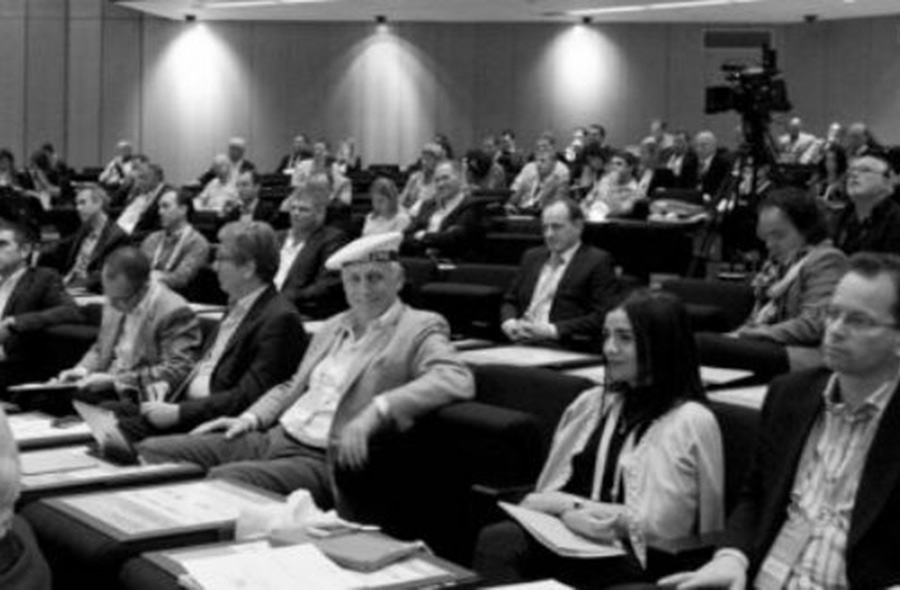
Image resolution: width=900 pixels, height=590 pixels. Identify the location of 3 lights on. (190, 73), (370, 85), (570, 48).